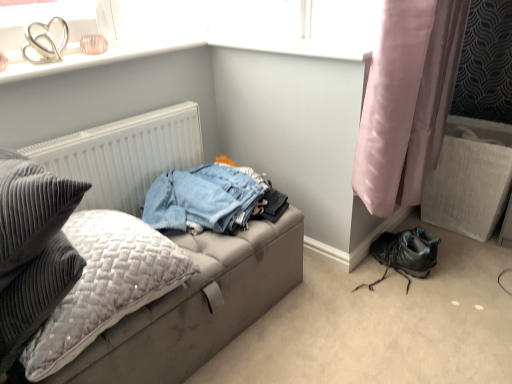
Question: Based on their positions, is velvet grey pillow at left located to the left or right of leatherette studio couch at left?

Choices:
 (A) left
 (B) right

Answer: (A)

Question: In terms of size, does velvet grey pillow at left appear bigger or smaller than leatherette studio couch at left?

Choices:
 (A) big
 (B) small

Answer: (B)

Question: Which is nearer to the pink satin curtain at lower right?

Choices:
 (A) velvet grey pillow at left
 (B) clear glass heart at upper left
 (C) white textured radiator at upper left
 (D) leatherette studio couch at left
 (E) matte black shoe at lower right

Answer: (E)

Question: Which is farther from the velvet grey pillow at left?

Choices:
 (A) pink satin curtain at lower right
 (B) matte black shoe at lower right
 (C) clear glass heart at upper left
 (D) leatherette studio couch at left
 (E) white textured radiator at upper left

Answer: (B)